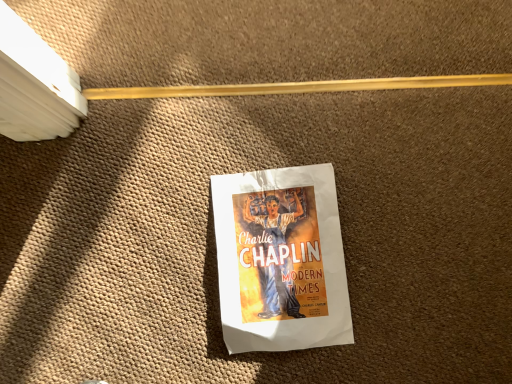
In order to click on vacant region to the left of white paper poster at center in this screenshot , I will do `click(148, 256)`.